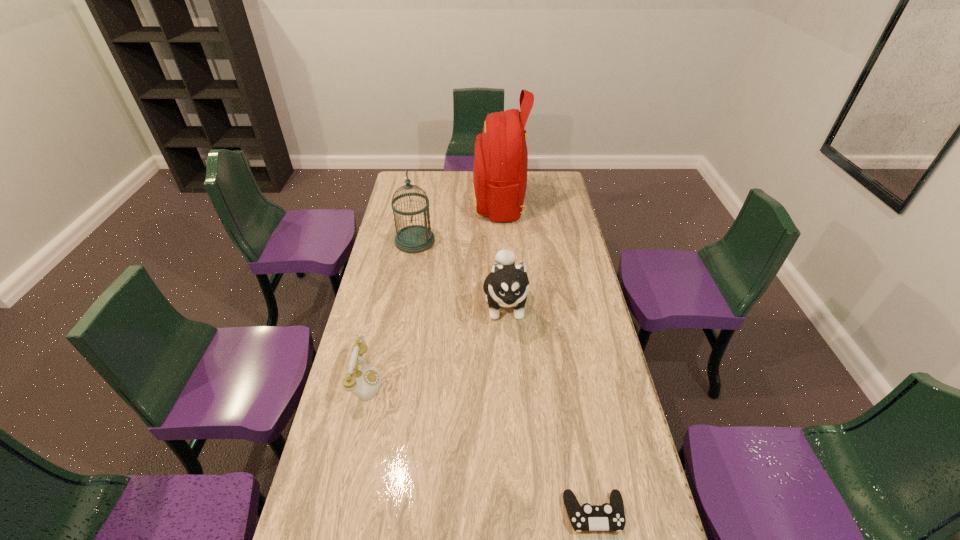
Find the location of a particular element. the tallest object is located at coordinates (500, 167).

Locate an element on the screen. Image resolution: width=960 pixels, height=540 pixels. the farthest object is located at coordinates (500, 167).

Find the location of a particular element. This screenshot has width=960, height=540. the fourth shortest object is located at coordinates click(416, 238).

At what (x,y) coordinates should I click in order to perform the action: click on birdcage. Please return your answer as a coordinate pair (x, y). The image size is (960, 540). Looking at the image, I should click on (416, 238).

Identify the location of the third farthest object. Image resolution: width=960 pixels, height=540 pixels. (507, 285).

Where is `puppy`? puppy is located at coordinates (507, 285).

Identify the location of the second nearest object. (365, 382).

Find the location of a particular element. telephone is located at coordinates (365, 382).

The image size is (960, 540). What are the coordinates of `the shortest object` in the screenshot? It's located at (610, 516).

Where is `the nearest object`? the nearest object is located at coordinates (610, 516).